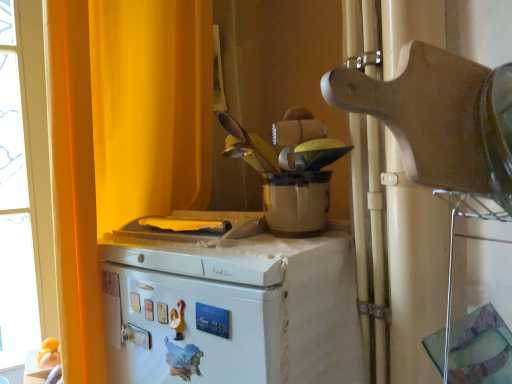
Question: Does wooden cutting board at upper right, the second appliance from the back, have a lesser height compared to yellow fabric curtain at upper left?

Choices:
 (A) no
 (B) yes

Answer: (B)

Question: Can you confirm if wooden cutting board at upper right, arranged as the first appliance when viewed from the front, is wider than yellow fabric curtain at upper left?

Choices:
 (A) no
 (B) yes

Answer: (B)

Question: Is wooden cutting board at upper right, the second appliance from the back, facing towards yellow fabric curtain at upper left?

Choices:
 (A) yes
 (B) no

Answer: (B)

Question: Is wooden cutting board at upper right, arranged as the first appliance when viewed from the front, bigger than yellow fabric curtain at upper left?

Choices:
 (A) yes
 (B) no

Answer: (B)

Question: From the image's perspective, is wooden cutting board at upper right, the second appliance from the back, below yellow fabric curtain at upper left?

Choices:
 (A) yes
 (B) no

Answer: (B)

Question: Is wooden cutting board at upper right, arranged as the first appliance when viewed from the front, outside yellow fabric curtain at upper left?

Choices:
 (A) no
 (B) yes

Answer: (B)

Question: Does white matte refrigerator at center appear on the right side of yellow fabric curtain at upper left?

Choices:
 (A) no
 (B) yes

Answer: (B)

Question: Considering the relative sizes of white matte refrigerator at center and yellow fabric curtain at upper left in the image provided, is white matte refrigerator at center taller than yellow fabric curtain at upper left?

Choices:
 (A) no
 (B) yes

Answer: (A)

Question: From a real-world perspective, is white matte refrigerator at center located beneath yellow fabric curtain at upper left?

Choices:
 (A) yes
 (B) no

Answer: (A)

Question: Does white matte refrigerator at center have a lesser height compared to yellow fabric curtain at upper left?

Choices:
 (A) no
 (B) yes

Answer: (B)

Question: Considering the relative sizes of white matte refrigerator at center and yellow fabric curtain at upper left in the image provided, is white matte refrigerator at center bigger than yellow fabric curtain at upper left?

Choices:
 (A) no
 (B) yes

Answer: (A)

Question: From a real-world perspective, does white matte refrigerator at center stand above yellow fabric curtain at upper left?

Choices:
 (A) yes
 (B) no

Answer: (B)

Question: Does matte white pot at center, marked as the 2th appliance in a front-to-back arrangement, turn towards white matte refrigerator at center?

Choices:
 (A) yes
 (B) no

Answer: (B)